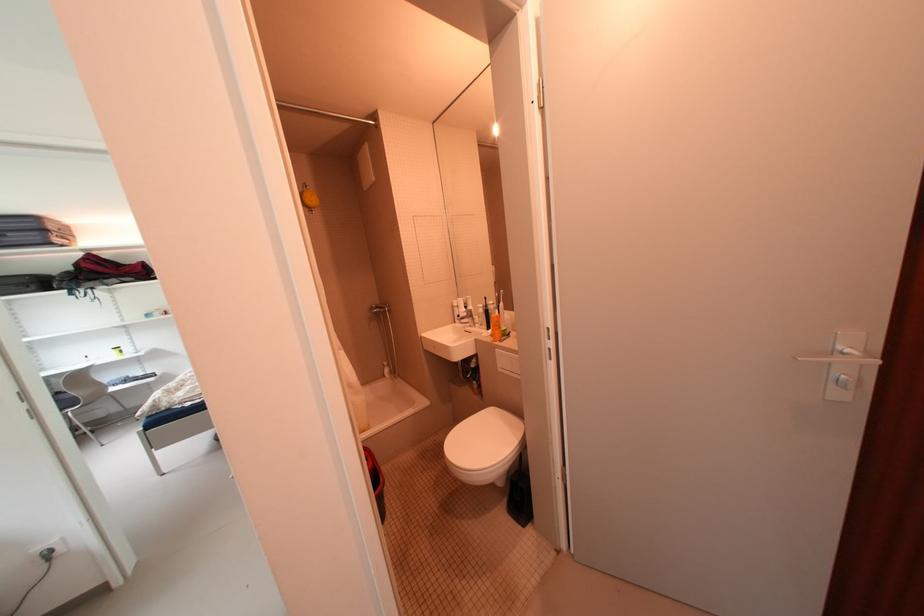
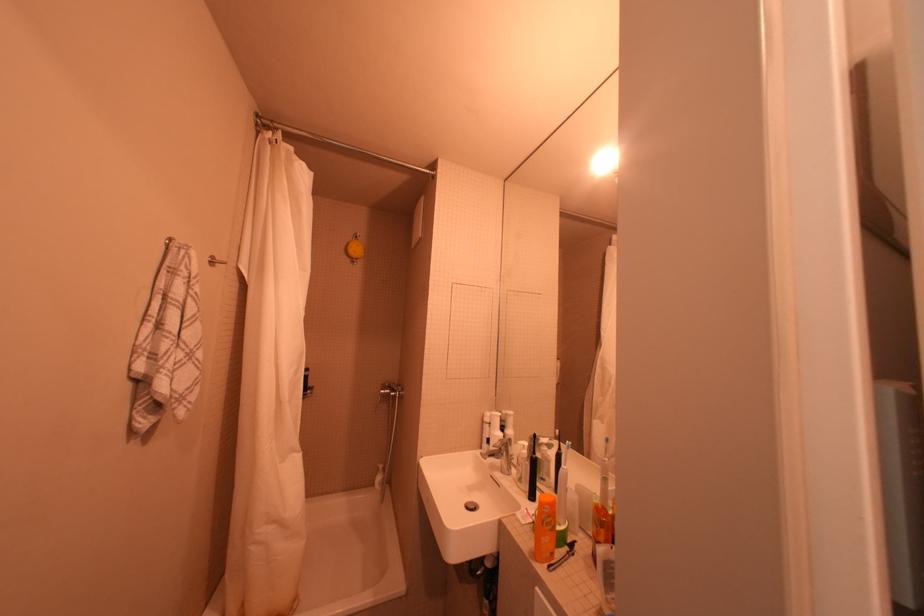
Where in the second image is the point corresponding to (505,323) from the first image?

(556, 517)